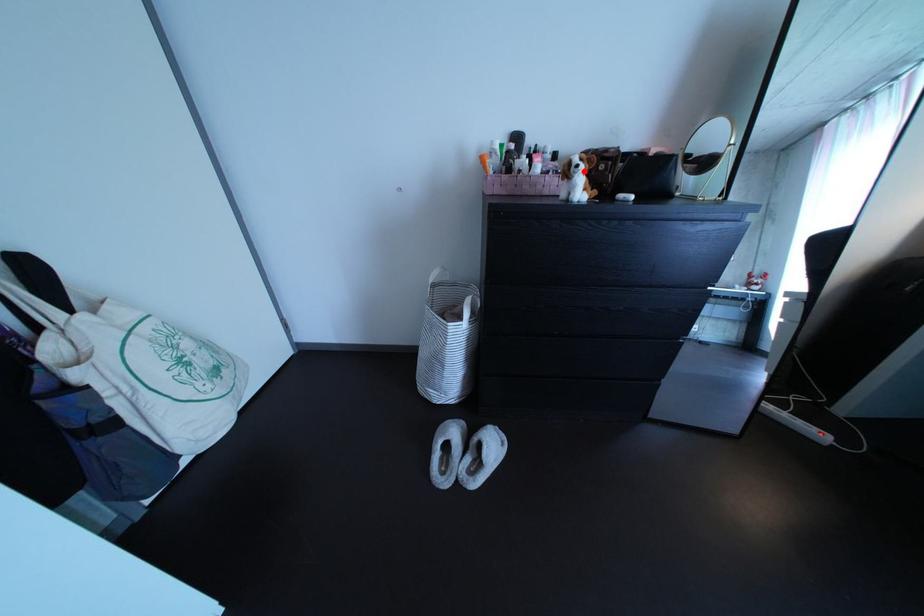
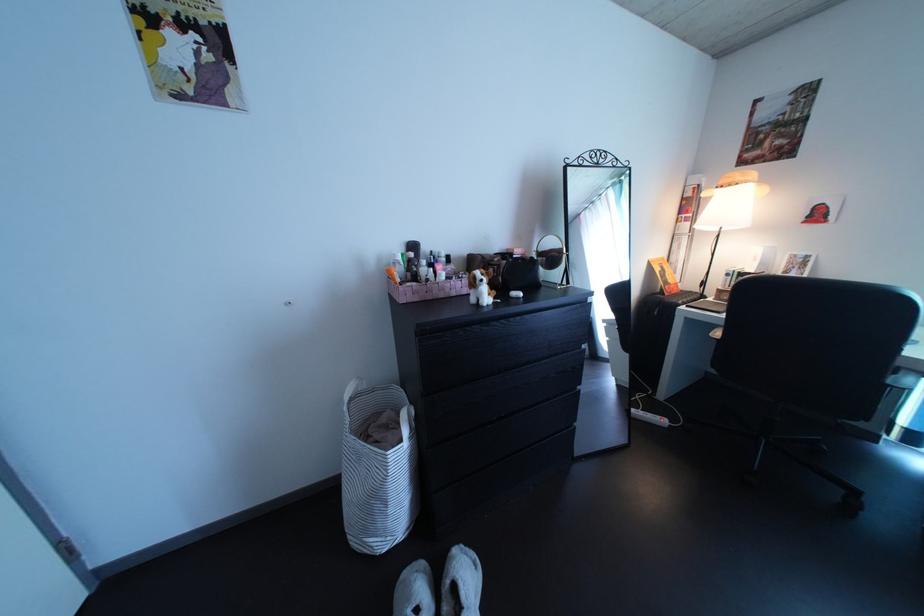
Find the pixel in the second image that matches the highlighted location in the first image.

(489, 286)